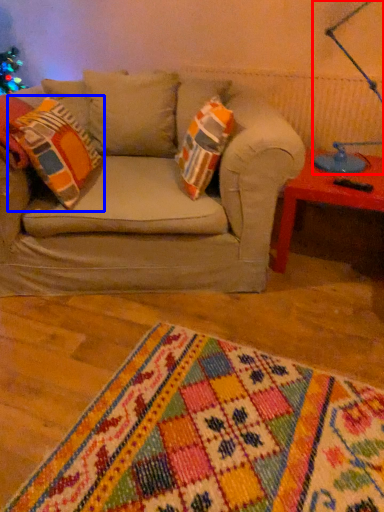
Question: Which object appears farthest to the camera in this image, table lamp (highlighted by a red box) or throw pillow (highlighted by a blue box)?

Choices:
 (A) table lamp
 (B) throw pillow

Answer: (A)